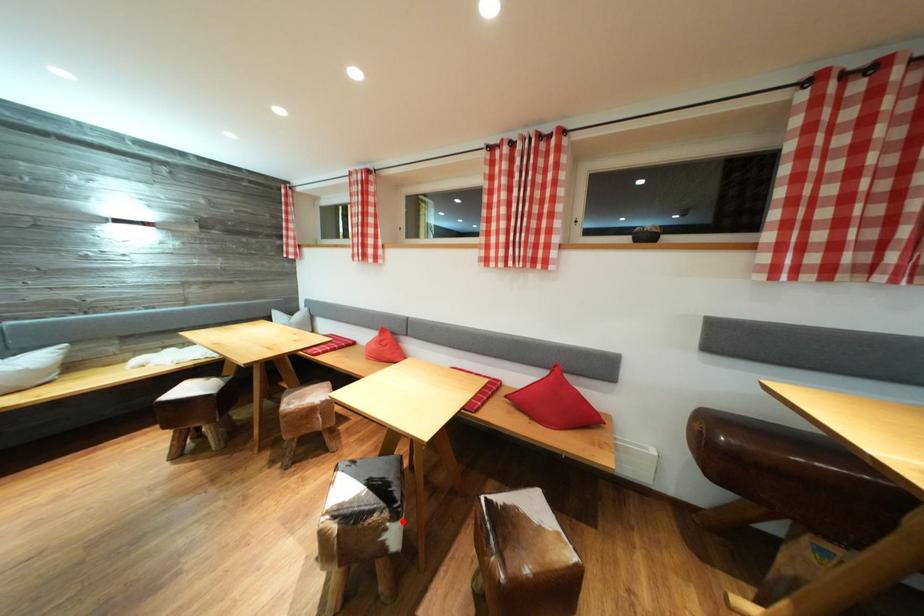
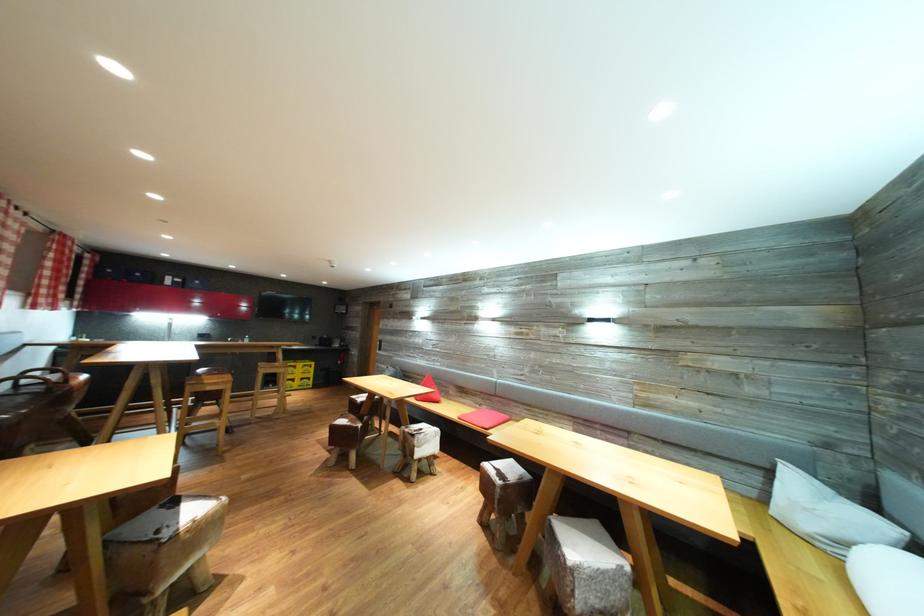
Question: I am providing you with two images of the same scene from different viewpoints. A red point is marked on the first image. Can you still see the location of the red point in image 2?

Choices:
 (A) Yes
 (B) No

Answer: (B)